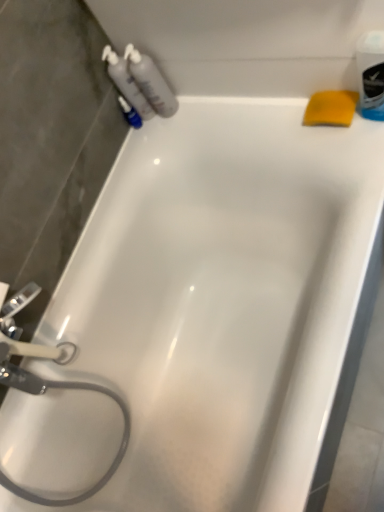
Question: From a real-world perspective, is translucent plastic bottles at upper left, acting as the second cleaning product starting from the left, on translucent plastic bottles at upper left, which is the 2th cleaning product in right-to-left order?

Choices:
 (A) no
 (B) yes

Answer: (B)

Question: Is translucent plastic bottles at upper left, acting as the second cleaning product starting from the left, not inside translucent plastic bottles at upper left, which is counted as the 1th cleaning product, starting from the left?

Choices:
 (A) yes
 (B) no

Answer: (A)

Question: Is translucent plastic bottles at upper left, acting as the second cleaning product starting from the left, far away from translucent plastic bottles at upper left, which is counted as the 1th cleaning product, starting from the left?

Choices:
 (A) yes
 (B) no

Answer: (B)

Question: Is translucent plastic bottles at upper left, acting as the second cleaning product starting from the left, shorter than translucent plastic bottles at upper left, which is counted as the 1th cleaning product, starting from the left?

Choices:
 (A) no
 (B) yes

Answer: (A)

Question: From a real-world perspective, is translucent plastic bottles at upper left, acting as the second cleaning product starting from the left, physically below translucent plastic bottles at upper left, which is the 2th cleaning product in right-to-left order?

Choices:
 (A) yes
 (B) no

Answer: (B)

Question: Is translucent plastic bottles at upper left, acting as the second cleaning product starting from the left, wider than translucent plastic bottles at upper left, which is the 2th cleaning product in right-to-left order?

Choices:
 (A) yes
 (B) no

Answer: (B)

Question: From the image's perspective, does blue plastic mouthwash at upper right appear lower than translucent plastic bottles at upper left, positioned as the first cleaning product in right-to-left order?

Choices:
 (A) no
 (B) yes

Answer: (B)

Question: Is there a large distance between blue plastic mouthwash at upper right and translucent plastic bottles at upper left, acting as the second cleaning product starting from the left?

Choices:
 (A) no
 (B) yes

Answer: (A)

Question: Considering the relative positions of blue plastic mouthwash at upper right and translucent plastic bottles at upper left, acting as the second cleaning product starting from the left, in the image provided, is blue plastic mouthwash at upper right to the right of translucent plastic bottles at upper left, acting as the second cleaning product starting from the left, from the viewer's perspective?

Choices:
 (A) yes
 (B) no

Answer: (A)

Question: From the image's perspective, is blue plastic mouthwash at upper right on translucent plastic bottles at upper left, acting as the second cleaning product starting from the left?

Choices:
 (A) no
 (B) yes

Answer: (A)

Question: Is blue plastic mouthwash at upper right completely or partially outside of translucent plastic bottles at upper left, acting as the second cleaning product starting from the left?

Choices:
 (A) no
 (B) yes

Answer: (B)

Question: Considering the relative sizes of blue plastic mouthwash at upper right and translucent plastic bottles at upper left, acting as the second cleaning product starting from the left, in the image provided, is blue plastic mouthwash at upper right wider than translucent plastic bottles at upper left, acting as the second cleaning product starting from the left,?

Choices:
 (A) no
 (B) yes

Answer: (A)

Question: Is yellow sponge at upper right taller than translucent plastic bottles at upper left, which is counted as the 1th cleaning product, starting from the left?

Choices:
 (A) no
 (B) yes

Answer: (A)